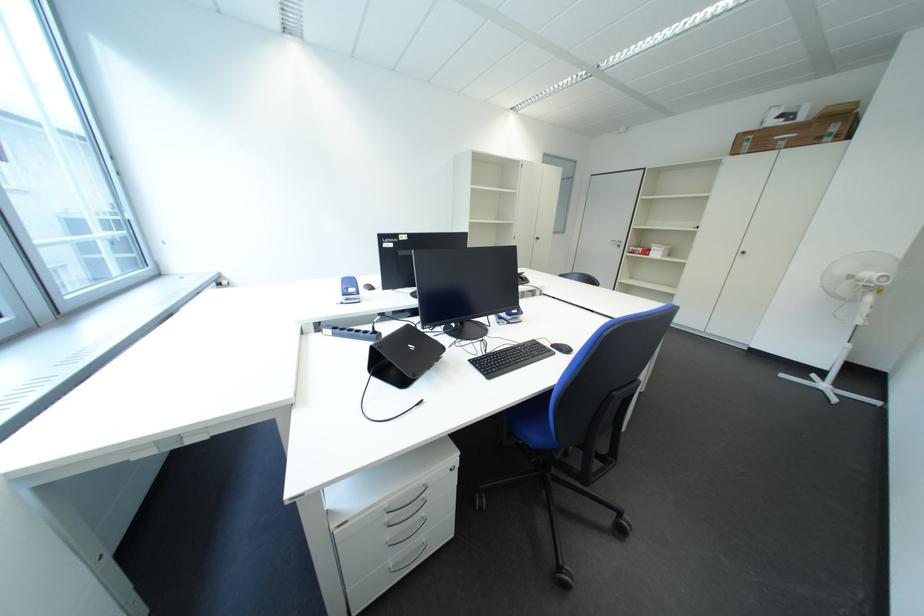
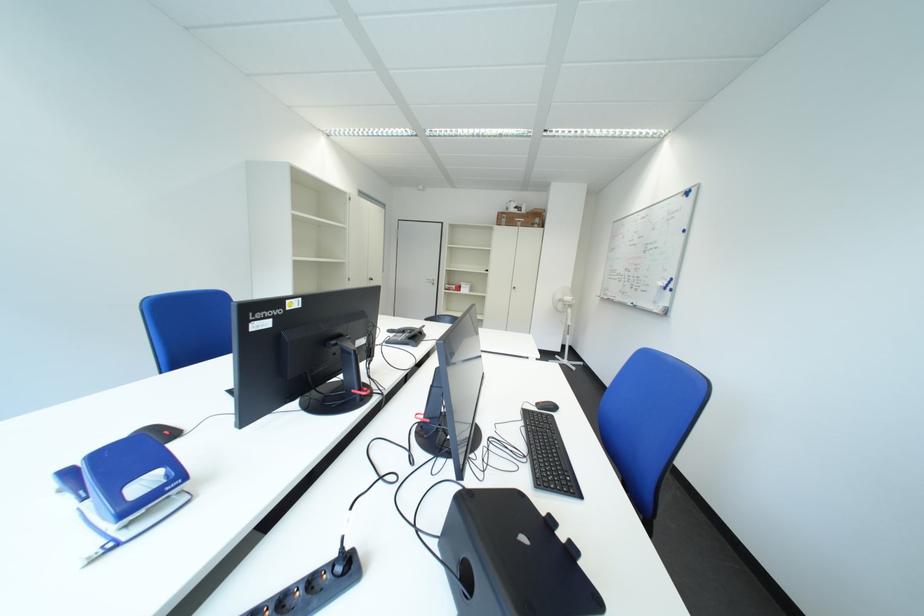
Question: The camera is either moving clockwise (left) or counter-clockwise (right) around the object. The first image is from the beginning of the video and the second image is from the end. Is the camera moving left or right when shooting the video?

Choices:
 (A) Left
 (B) Right

Answer: (A)